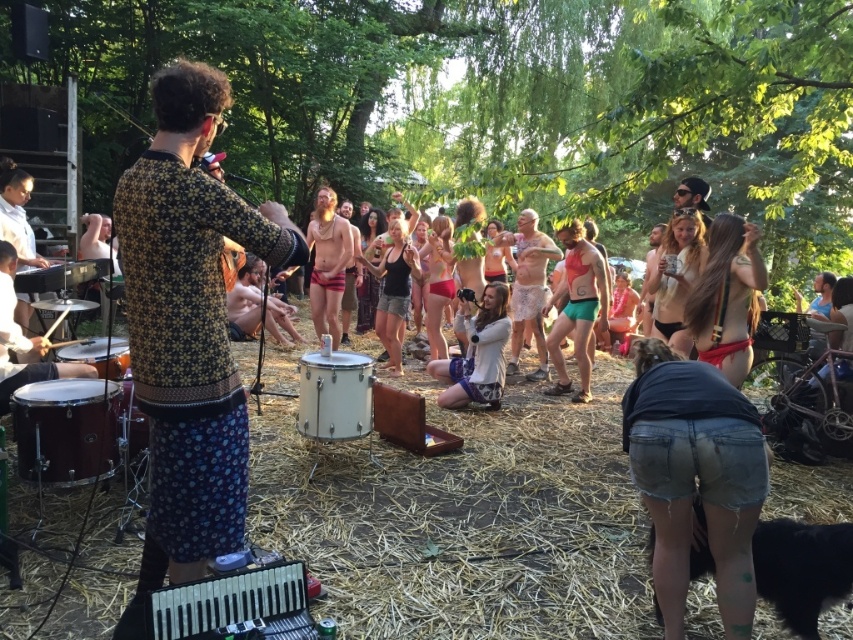
You are a photographer at the event and want to capture a photo of the white metallic drum at center. The camera requires the drum to be within a 0.5x0.5 meter area centered at point 0.6, 0.4. Will the drum fit in this area?

The white metallic drum at center is located at point (335,396), which is within the 0.5x0.5 meter area centered at (340,384). Therefore, the drum will fit in the area.

You are a photographer at the event and want to capture both the man playing the melodica and the drum set in your photo. The man is at point (370, 376) and the drum set is at point (505, 326). Which of these two points is closer to you?

Point (370, 376) is closer to the viewer than point (505, 326), so the man playing the melodica is closer to you.

You are a photographer at the event and want to capture a photo of the white metallic drum at center and the light gray sweater at center. Which object is shorter in height?

The white metallic drum at center is not as tall as the light gray sweater at center, so the white metallic drum at center is shorter in height.